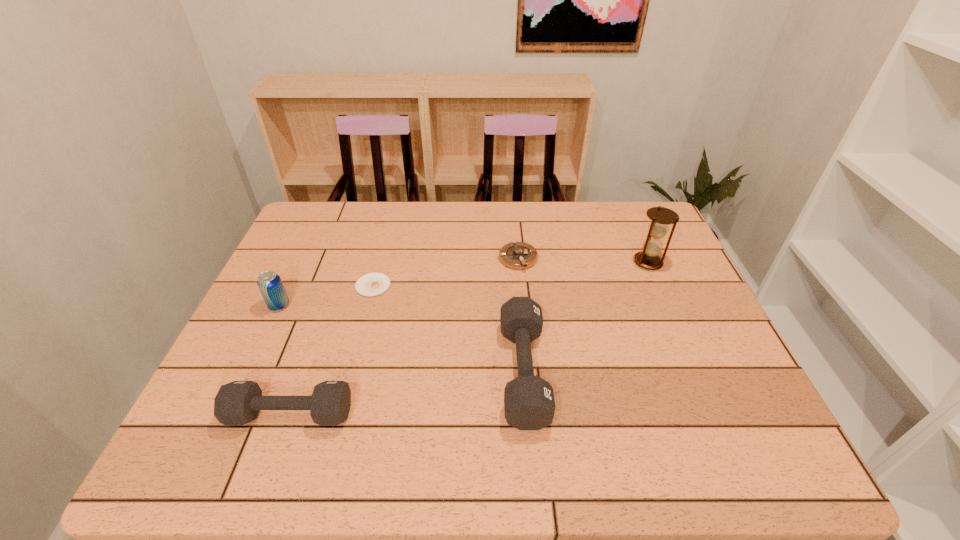
The width and height of the screenshot is (960, 540). In order to click on the left dumbbell in this screenshot , I will do `click(237, 403)`.

What are the coordinates of `the shorter dumbbell` in the screenshot? It's located at (237, 403).

The image size is (960, 540). I want to click on the right dumbbell, so click(529, 404).

Where is `the shortest object`? Image resolution: width=960 pixels, height=540 pixels. the shortest object is located at coordinates pyautogui.click(x=372, y=284).

In order to click on the third farthest object in this screenshot , I will do `click(372, 284)`.

Find the location of a particular element. The height and width of the screenshot is (540, 960). the second shortest object is located at coordinates (520, 255).

You are a GUI agent. You are given a task and a screenshot of the screen. Output one action in this format:
    pyautogui.click(x=<x>, y=<y>)
    Task: Click on the fourth farthest object
    This screenshot has width=960, height=540.
    Given the screenshot: What is the action you would take?
    pyautogui.click(x=270, y=284)

At what (x,y) coordinates should I click in order to perform the action: click on hourglass. Please return your answer as a coordinate pair (x, y). The width and height of the screenshot is (960, 540). Looking at the image, I should click on (661, 217).

Image resolution: width=960 pixels, height=540 pixels. I want to click on the tallest object, so click(661, 217).

Identify the location of free location located 0.330m on the right of the shorter dumbbell. (505, 414).